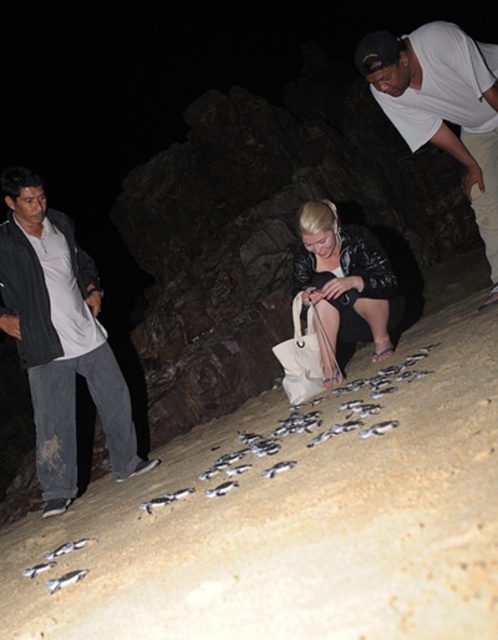
Can you confirm if light brown sandy beach at center is smaller than dark gray jacket at left?

Incorrect, light brown sandy beach at center is not smaller in size than dark gray jacket at left.

Does light brown sandy beach at center appear over dark gray jacket at left?

Incorrect, light brown sandy beach at center is not positioned above dark gray jacket at left.

Locate an element on the screen. The width and height of the screenshot is (498, 640). light brown sandy beach at center is located at coordinates (298, 515).

Identify the location of light brown sandy beach at center. The height and width of the screenshot is (640, 498). (298, 515).

Does white matte shirt at upper right have a smaller size compared to black leather jacket at center?

No, white matte shirt at upper right is not smaller than black leather jacket at center.

Does white matte shirt at upper right have a greater height compared to black leather jacket at center?

Yes, white matte shirt at upper right is taller than black leather jacket at center.

Describe the element at coordinates (444, 108) in the screenshot. I see `white matte shirt at upper right` at that location.

Image resolution: width=498 pixels, height=640 pixels. In order to click on white matte shirt at upper right in this screenshot , I will do `click(444, 108)`.

Which of these two, light brown sandy beach at center or white matte shirt at upper right, stands taller?

Standing taller between the two is white matte shirt at upper right.

Locate an element on the screen. The height and width of the screenshot is (640, 498). light brown sandy beach at center is located at coordinates (298, 515).

Find the location of a particular element. The height and width of the screenshot is (640, 498). light brown sandy beach at center is located at coordinates (298, 515).